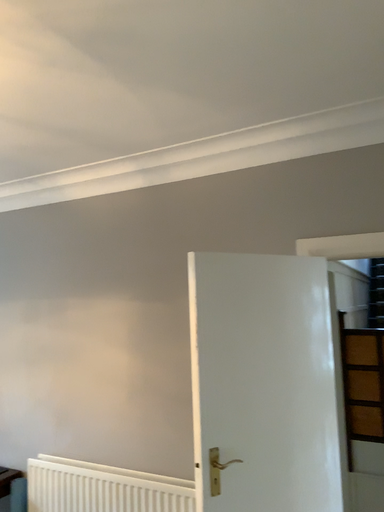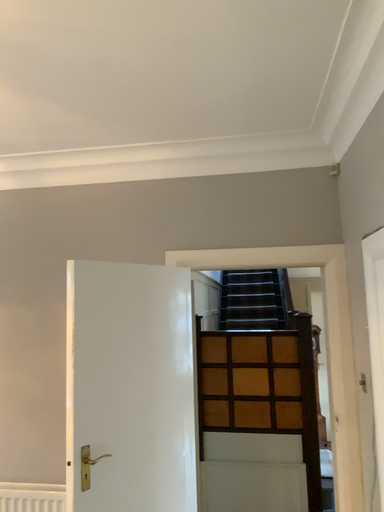
Question: How did the camera likely rotate when shooting the video?

Choices:
 (A) rotated right
 (B) rotated left

Answer: (A)